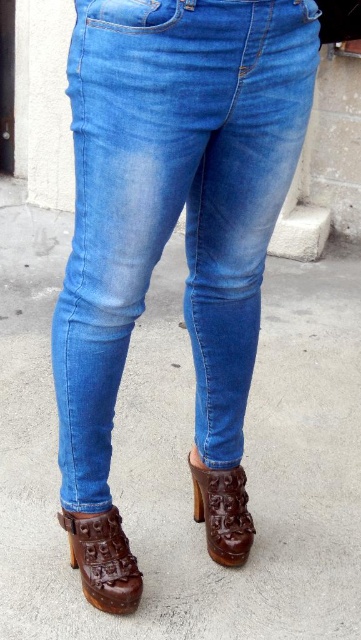
Question: Which object is farther from the camera taking this photo?

Choices:
 (A) denim jeans at center
 (B) brown leather sandal at lower center
 (C) brown leather shoe at lower left

Answer: (B)

Question: Which is nearer to the denim jeans at center?

Choices:
 (A) brown leather sandal at lower center
 (B) brown leather shoe at lower left

Answer: (A)

Question: Does denim jeans at center appear under brown leather sandal at lower center?

Choices:
 (A) no
 (B) yes

Answer: (A)

Question: Is brown leather shoe at lower left smaller than brown leather sandal at lower center?

Choices:
 (A) no
 (B) yes

Answer: (A)

Question: Based on their relative distances, which object is farther from the brown leather sandal at lower center?

Choices:
 (A) denim jeans at center
 (B) brown leather shoe at lower left

Answer: (A)

Question: Is denim jeans at center closer to the viewer compared to brown leather sandal at lower center?

Choices:
 (A) no
 (B) yes

Answer: (B)